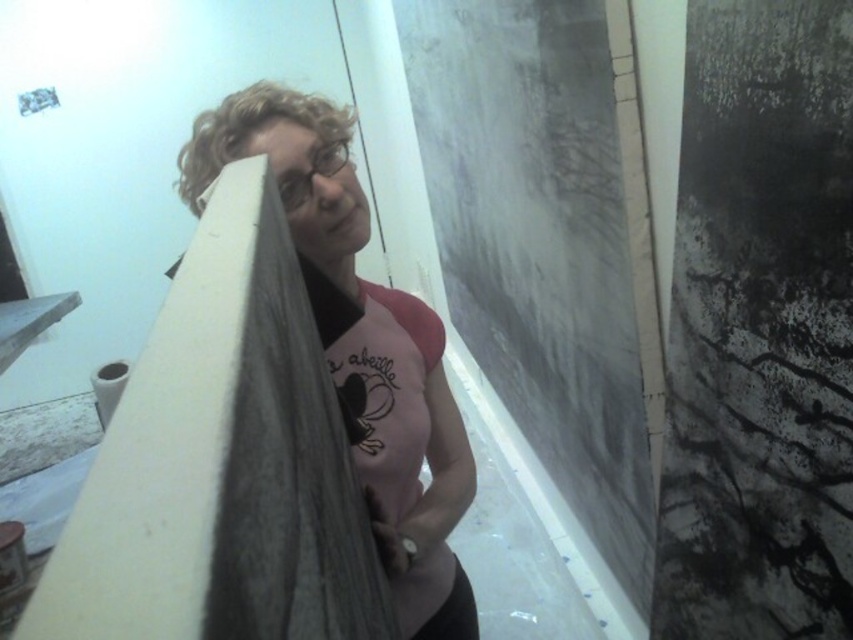
You are a painter in a dimly lit room with a bluish tint. You need to place a 25 cm ruler between the matte gray fabric at center and the curly blonde hair at upper left. Will the ruler fit exactly between them?

The distance between the matte gray fabric at center and the curly blonde hair at upper left is 25.12 centimeters, which is slightly longer than the 25 cm ruler. Therefore, the ruler will fit with a small gap remaining.

You are a painter who needs to choose between using the matte gray fabric at center and the curly blonde hair at upper left as a painting tool. Which object is wider and would cover more area?

The matte gray fabric at center is wider than the curly blonde hair at upper left, so it would cover more area when used as a painting tool.

You are a painter holding a 24 inch wide brush. You want to paint the matte gray fabric at center without moving your position. Is the distance sufficient to paint it?

The matte gray fabric at center is 30.49 inches from viewer. Since the brush is 24 inches wide, the distance is sufficient to paint it as the fabric is farther than the brush length.